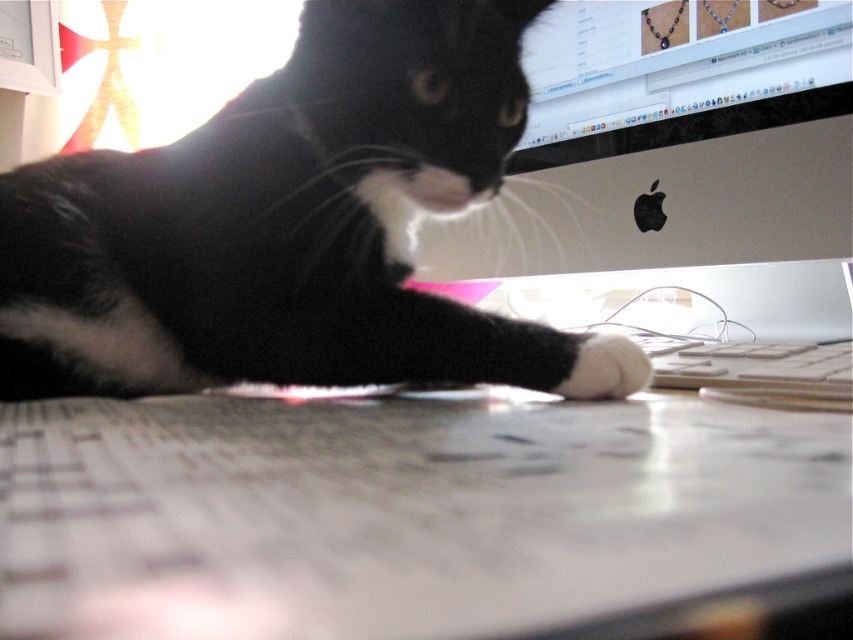
Question: Is black fur cat at center closer to the viewer compared to white plastic keyboard at right?

Choices:
 (A) yes
 (B) no

Answer: (B)

Question: Can you confirm if white glossy desk at center is bigger than white soft paw at center?

Choices:
 (A) yes
 (B) no

Answer: (A)

Question: Which point is farther from the camera taking this photo?

Choices:
 (A) coord(375,97)
 (B) coord(705,365)
 (C) coord(618,358)

Answer: (B)

Question: Can you confirm if white glossy desk at center is positioned to the left of white soft paw at center?

Choices:
 (A) no
 (B) yes

Answer: (B)

Question: Among these points, which one is farthest from the camera?

Choices:
 (A) (76, 429)
 (B) (813, 378)

Answer: (B)

Question: Which is farther from the white plastic keyboard at right?

Choices:
 (A) white glossy desk at center
 (B) white soft paw at center
 (C) black fur cat at center

Answer: (C)